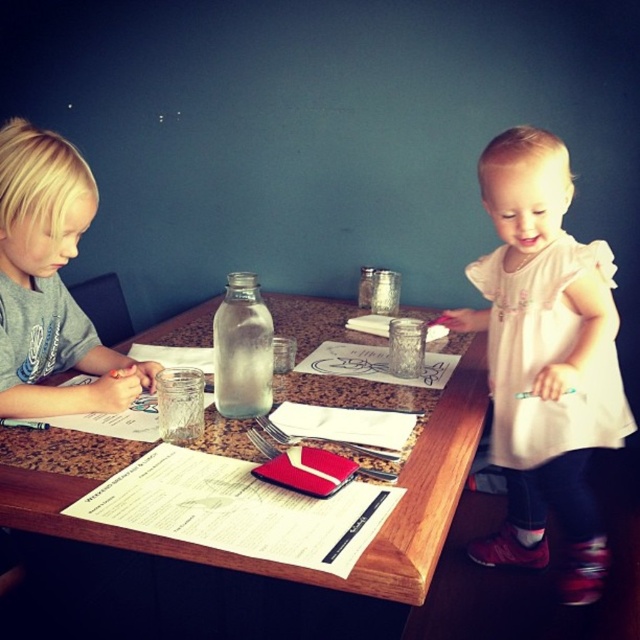
You are a tailor who needs to determine which garment requires more fabric based on their height. Given the white cotton dress at upper right and the smooth gray shirt at left, which one would need more fabric?

The white cotton dress at upper right is much taller than the smooth gray shirt at left, so it would require more fabric.

You are a fashion designer who wants to place the white cotton dress at upper right next to the transparent glass bottle at center on a mannequin. Given that the mannequin has a 24 inch wide base, can you fit both items side by side without overlapping?

The distance between the white cotton dress at upper right and transparent glass bottle at center is 26.65 inches. Since the mannequin base is only 24 inches wide, they cannot be placed side by side without overlapping.